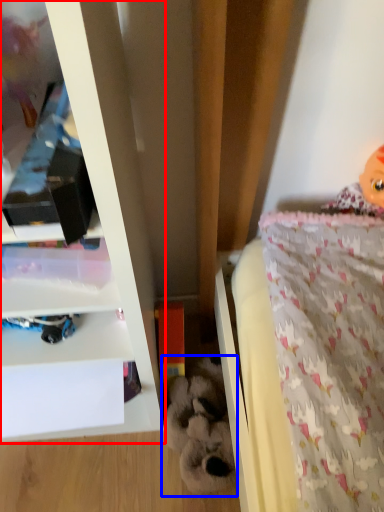
Question: Which of the following is the closest to the observer, shelf (highlighted by a red box) or toy (highlighted by a blue box)?

Choices:
 (A) shelf
 (B) toy

Answer: (A)